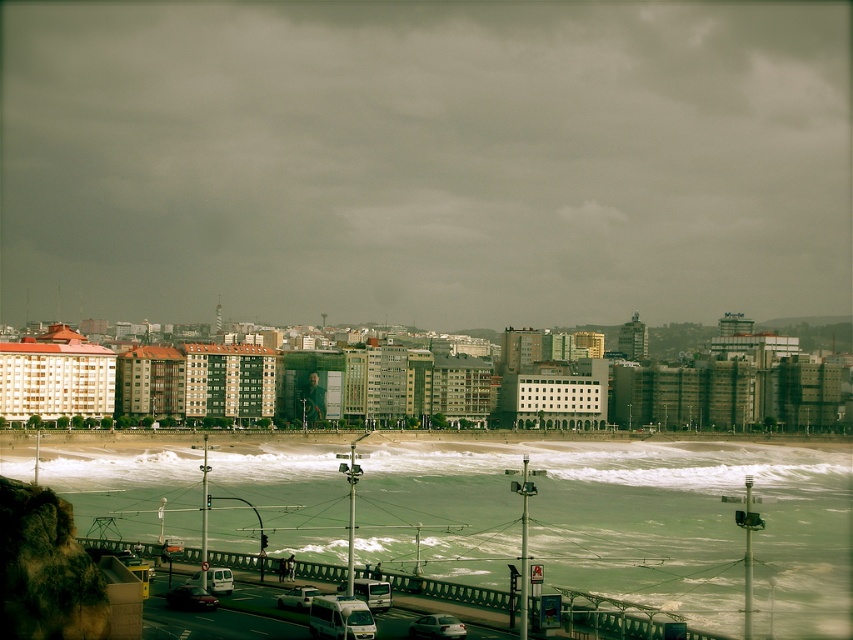
You are standing at the point closer to you in the image. Which point are you at, point (669, 476) or point (434, 616)?

You are at point (669, 476) because it is closer to the viewer than point (434, 616).